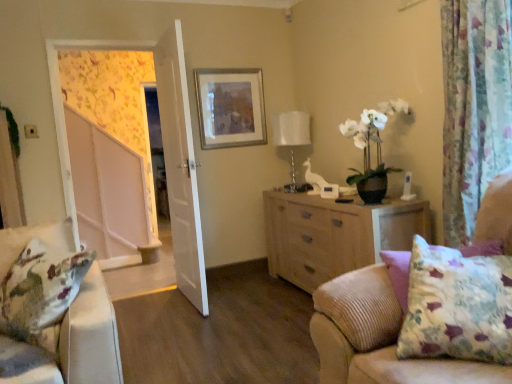
Question: Could you tell me if floral fabric curtain at right is turned towards white glossy table lamp at upper center?

Choices:
 (A) no
 (B) yes

Answer: (A)

Question: From the image's perspective, is floral fabric curtain at right on white glossy table lamp at upper center?

Choices:
 (A) no
 (B) yes

Answer: (A)

Question: Does floral fabric curtain at right have a greater height compared to white glossy table lamp at upper center?

Choices:
 (A) no
 (B) yes

Answer: (B)

Question: Is floral fabric curtain at right not close to white glossy table lamp at upper center?

Choices:
 (A) no
 (B) yes

Answer: (B)

Question: Considering the relative sizes of floral fabric curtain at right and white glossy table lamp at upper center in the image provided, is floral fabric curtain at right shorter than white glossy table lamp at upper center?

Choices:
 (A) no
 (B) yes

Answer: (A)

Question: In the image, is floral fabric curtain at right positioned in front of or behind silver metallic picture frame at upper center?

Choices:
 (A) behind
 (B) front

Answer: (B)

Question: From a real-world perspective, is floral fabric curtain at right physically located above or below silver metallic picture frame at upper center?

Choices:
 (A) below
 (B) above

Answer: (A)

Question: Considering the positions of floral fabric curtain at right and silver metallic picture frame at upper center in the image, is floral fabric curtain at right taller or shorter than silver metallic picture frame at upper center?

Choices:
 (A) tall
 (B) short

Answer: (A)

Question: Considering the positions of floral fabric curtain at right and silver metallic picture frame at upper center in the image, is floral fabric curtain at right wider or thinner than silver metallic picture frame at upper center?

Choices:
 (A) wide
 (B) thin

Answer: (A)

Question: Is white glossy screen door at left to the left or to the right of light wood dresser at center in the image?

Choices:
 (A) left
 (B) right

Answer: (A)

Question: From a real-world perspective, relative to light wood dresser at center, is white glossy screen door at left vertically above or below?

Choices:
 (A) below
 (B) above

Answer: (B)

Question: From the image's perspective, is white glossy screen door at left above or below light wood dresser at center?

Choices:
 (A) above
 (B) below

Answer: (A)

Question: Is point (84, 216) positioned closer to the camera than point (288, 218)?

Choices:
 (A) farther
 (B) closer

Answer: (A)

Question: In the image, is silver metallic picture frame at upper center on the left side or the right side of floral fabric curtain at right?

Choices:
 (A) right
 (B) left

Answer: (B)

Question: Considering the positions of silver metallic picture frame at upper center and floral fabric curtain at right in the image, is silver metallic picture frame at upper center wider or thinner than floral fabric curtain at right?

Choices:
 (A) thin
 (B) wide

Answer: (A)